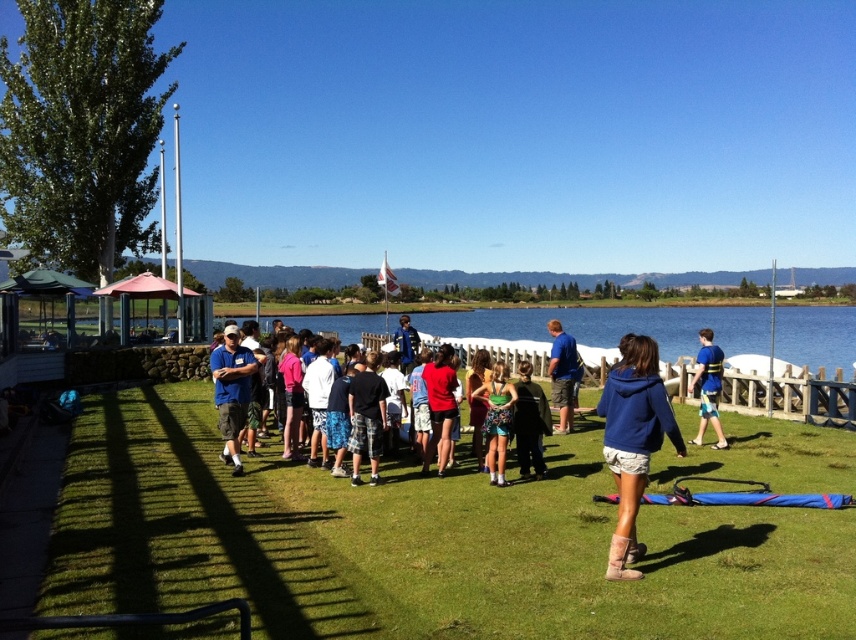
Can you confirm if matte red shirt at center is shorter than green jersey at center?

In fact, matte red shirt at center may be taller than green jersey at center.

Describe the element at coordinates (438, 406) in the screenshot. I see `matte red shirt at center` at that location.

What are the coordinates of `matte red shirt at center` in the screenshot? It's located at (438, 406).

Which is below, matte blue shirt at center or blue fabric jacket at center?

Positioned lower is matte blue shirt at center.

Can you confirm if matte blue shirt at center is shorter than blue fabric jacket at center?

No, matte blue shirt at center is not shorter than blue fabric jacket at center.

Is point (217, 404) less distant than point (409, 348)?

That is True.

The image size is (856, 640). In order to click on matte blue shirt at center in this screenshot , I will do `click(230, 392)`.

Consider the image. Between green grass at center and floral dress at center, which one appears on the left side from the viewer's perspective?

floral dress at center

Does point (302, 627) come behind point (504, 454)?

That is False.

Does point (360, 618) lie behind point (492, 432)?

No, (360, 618) is closer to viewer.

This screenshot has height=640, width=856. Find the location of `green grass at center`. green grass at center is located at coordinates (415, 544).